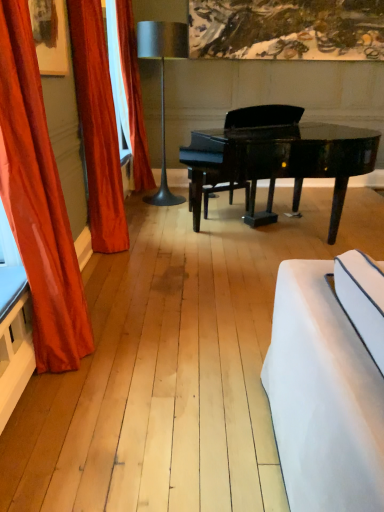
Question: Is satin orange curtain at left, which is the third curtain in back-to-front order, behind metallic gray floor lamp at center?

Choices:
 (A) yes
 (B) no

Answer: (B)

Question: Does satin orange curtain at left, the 1th curtain positioned from the front, have a greater height compared to metallic gray floor lamp at center?

Choices:
 (A) no
 (B) yes

Answer: (A)

Question: Is there a large distance between satin orange curtain at left, the 1th curtain positioned from the front, and metallic gray floor lamp at center?

Choices:
 (A) no
 (B) yes

Answer: (B)

Question: Can you confirm if satin orange curtain at left, which is the third curtain in back-to-front order, is positioned to the left of metallic gray floor lamp at center?

Choices:
 (A) no
 (B) yes

Answer: (B)

Question: From a real-world perspective, is satin orange curtain at left, which is the third curtain in back-to-front order, located beneath metallic gray floor lamp at center?

Choices:
 (A) yes
 (B) no

Answer: (A)

Question: Is glossy black piano at center taller or shorter than orange velvet curtain at left, the 3th curtain in the front-to-back sequence?

Choices:
 (A) short
 (B) tall

Answer: (A)

Question: Considering their positions, is glossy black piano at center located in front of or behind orange velvet curtain at left, the first curtain when ordered from back to front?

Choices:
 (A) front
 (B) behind

Answer: (A)

Question: Considering the positions of glossy black piano at center and orange velvet curtain at left, the 3th curtain in the front-to-back sequence, in the image, is glossy black piano at center wider or thinner than orange velvet curtain at left, the 3th curtain in the front-to-back sequence,?

Choices:
 (A) wide
 (B) thin

Answer: (A)

Question: Does point (342, 131) appear closer or farther from the camera than point (120, 33)?

Choices:
 (A) closer
 (B) farther

Answer: (B)

Question: Looking at the image, does satin orange curtain at left, the 1th curtain positioned from the front, seem bigger or smaller compared to glossy black piano at center?

Choices:
 (A) small
 (B) big

Answer: (A)

Question: In the image, is satin orange curtain at left, which is the third curtain in back-to-front order, positioned in front of or behind glossy black piano at center?

Choices:
 (A) behind
 (B) front

Answer: (B)

Question: Is satin orange curtain at left, which is the third curtain in back-to-front order, taller or shorter than glossy black piano at center?

Choices:
 (A) tall
 (B) short

Answer: (A)

Question: Considering the positions of point click(x=18, y=2) and point click(x=296, y=137), is point click(x=18, y=2) closer or farther from the camera than point click(x=296, y=137)?

Choices:
 (A) closer
 (B) farther

Answer: (A)

Question: Visually, is glossy black piano at center positioned to the left or to the right of metallic gray floor lamp at center?

Choices:
 (A) right
 (B) left

Answer: (A)

Question: Is glossy black piano at center inside the boundaries of metallic gray floor lamp at center, or outside?

Choices:
 (A) inside
 (B) outside

Answer: (B)